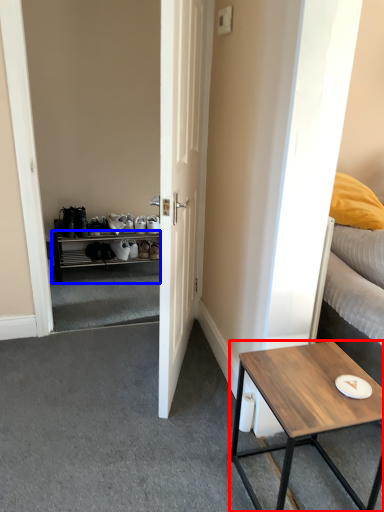
Question: Which of the following is the closest to the observer, coffee table (highlighted by a red box) or cabinetry (highlighted by a blue box)?

Choices:
 (A) coffee table
 (B) cabinetry

Answer: (A)